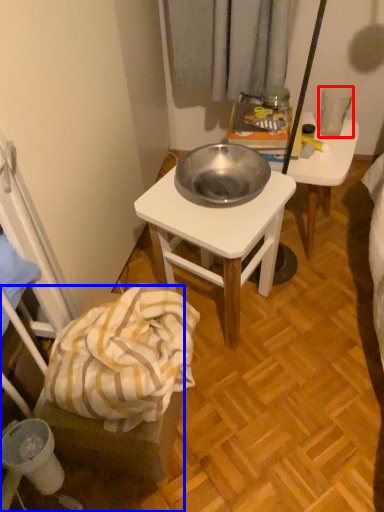
Question: Which object appears farthest to the camera in this image, coffee cup (highlighted by a red box) or chair (highlighted by a blue box)?

Choices:
 (A) coffee cup
 (B) chair

Answer: (A)